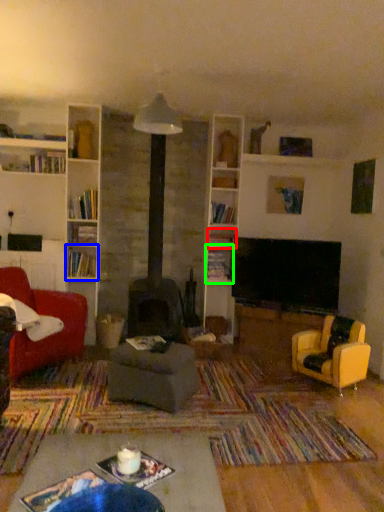
Question: Which object is positioned farthest from shelf (highlighted by a red box)? Select from shelf (highlighted by a blue box) and shelf (highlighted by a green box).

Choices:
 (A) shelf
 (B) shelf

Answer: (A)